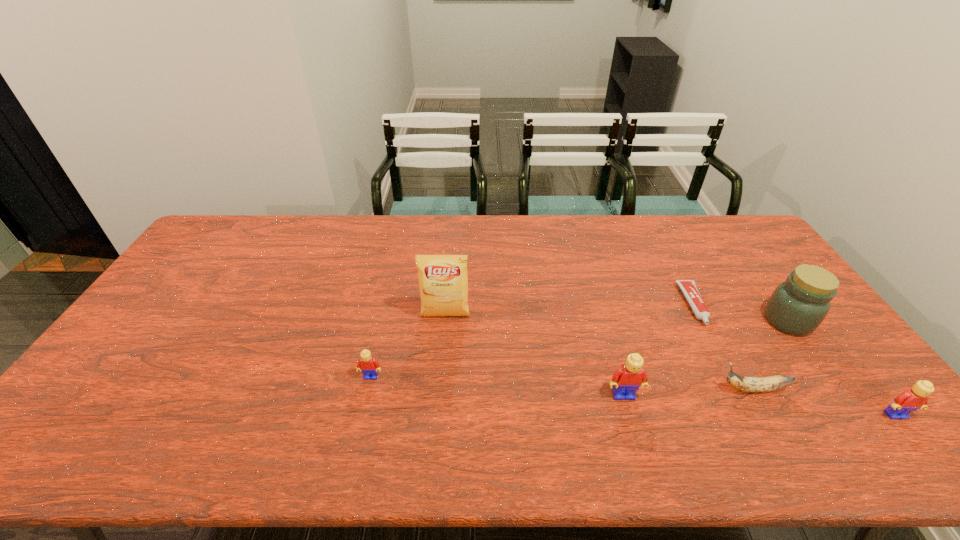
At what (x,y) coordinates should I click in order to perform the action: click on vacant region that satisfies the following two spatial constraints: 1. on the front of the jar with the logo; 2. on the left side of the tallest object. Please return your answer as a coordinate pair (x, y). Looking at the image, I should click on (445, 321).